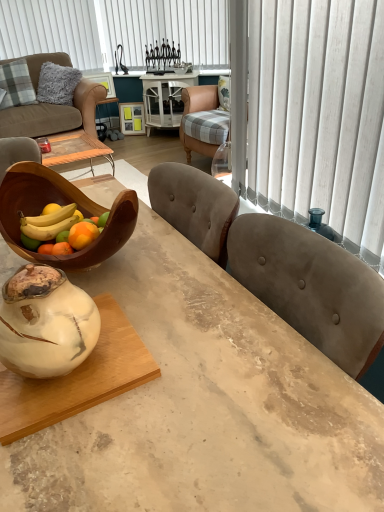
Locate an element on the screen. free space behind white marble coffee table at lower left is located at coordinates (139, 278).